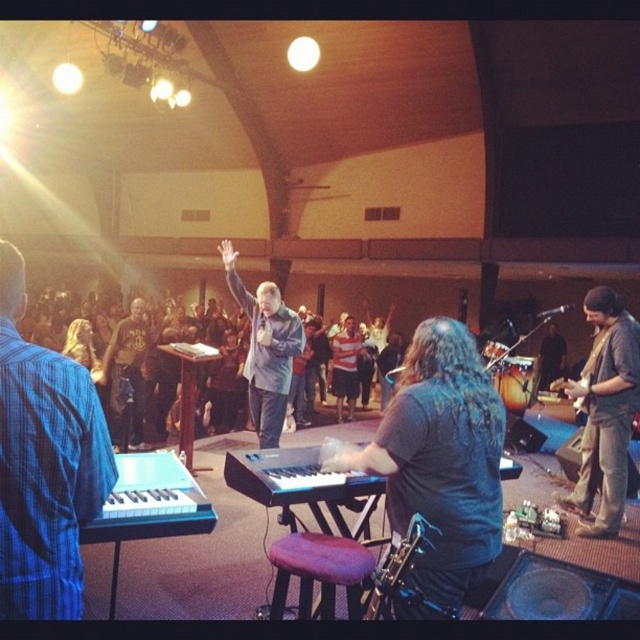
You are a photographer standing at the back of the hall. You see the denim jacket at right and the metallic silver saxophone at center. Which object is positioned higher in the image?

The denim jacket at right is above the metallic silver saxophone at center, so it is positioned higher in the image.

You are a photographer positioned at the center of the stage. You want to take a photo of the denim jacket at right. According to the coordinates provided, in which direction should you move to capture the jacket in your frame?

The denim jacket at right is located at coordinates point (x=604, y=412). Since you are at the center, you should move to the right to align with the jacket.